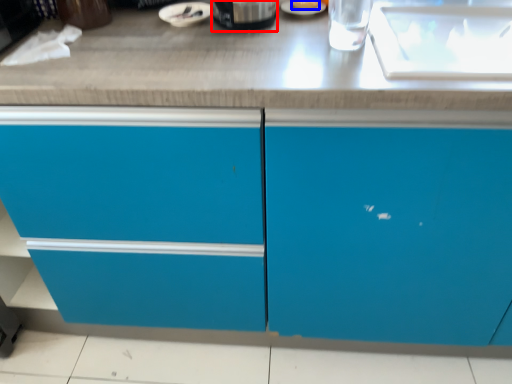
Question: Which of the following is the closest to the observer, appliance (highlighted by a red box) or food (highlighted by a blue box)?

Choices:
 (A) appliance
 (B) food

Answer: (A)